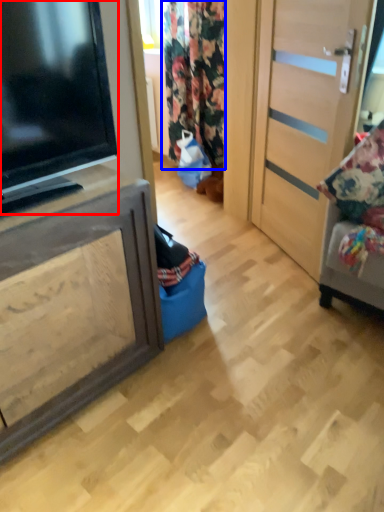
Question: Which of the following is the closest to the observer, television (highlighted by a red box) or curtain (highlighted by a blue box)?

Choices:
 (A) television
 (B) curtain

Answer: (A)